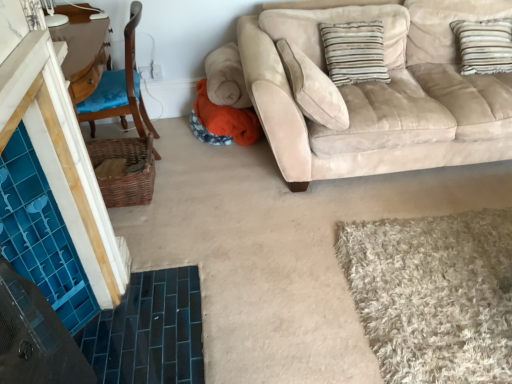
Question: Can you confirm if beige shaggy rug at lower right is shorter than blue fabric chair at left?

Choices:
 (A) no
 (B) yes

Answer: (B)

Question: Can we say beige shaggy rug at lower right lies outside blue fabric chair at left?

Choices:
 (A) no
 (B) yes

Answer: (B)

Question: Would you say blue fabric chair at left is part of beige shaggy rug at lower right's contents?

Choices:
 (A) no
 (B) yes

Answer: (A)

Question: Is the position of beige shaggy rug at lower right more distant than that of blue fabric chair at left?

Choices:
 (A) yes
 (B) no

Answer: (B)

Question: Can you confirm if beige shaggy rug at lower right is bigger than blue fabric chair at left?

Choices:
 (A) yes
 (B) no

Answer: (B)

Question: Can you confirm if beige shaggy rug at lower right is taller than blue fabric chair at left?

Choices:
 (A) no
 (B) yes

Answer: (A)

Question: Are blue fabric chair at left and striped fabric pillow at upper right located far from each other?

Choices:
 (A) no
 (B) yes

Answer: (B)

Question: Is blue fabric chair at left closer to camera compared to striped fabric pillow at upper right?

Choices:
 (A) no
 (B) yes

Answer: (B)

Question: From the image's perspective, is blue fabric chair at left above striped fabric pillow at upper right?

Choices:
 (A) yes
 (B) no

Answer: (B)

Question: Can you see blue fabric chair at left touching striped fabric pillow at upper right?

Choices:
 (A) no
 (B) yes

Answer: (A)

Question: Is striped fabric pillow at upper right at the back of blue fabric chair at left?

Choices:
 (A) no
 (B) yes

Answer: (B)

Question: Can you confirm if blue fabric chair at left is shorter than striped fabric pillow at upper right?

Choices:
 (A) no
 (B) yes

Answer: (A)

Question: From the image's perspective, does suede beige couch at upper right appear higher than striped fabric pillow at upper right?

Choices:
 (A) yes
 (B) no

Answer: (B)